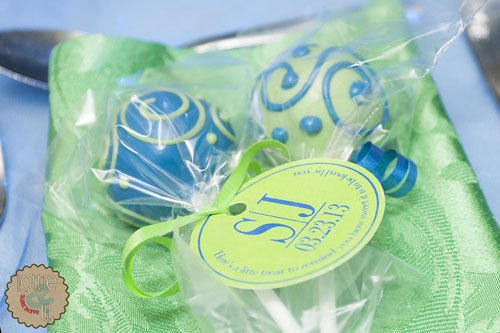
Identify the location of spoon handle. (229, 39).